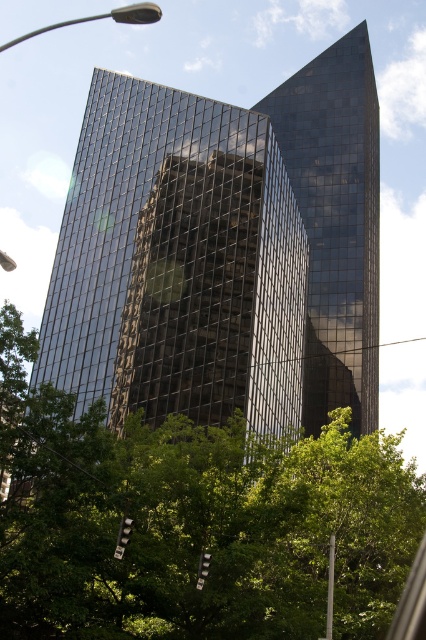
You are a city planner evaluating the impact of new construction on green spaces. You observe the shiny glass building at center and the green leafy tree at lower center in the proposed area. Based on their widths, which structure occupies more horizontal space?

The shiny glass building at center has a greater width than the green leafy tree at lower center, so it occupies more horizontal space.

You are a city planner assessing the impact of new construction on sunlight availability. You observe the shiny glass building at center and the green leafy tree at lower center. Which object would cast a longer shadow during midday in summer?

The shiny glass building at center is much taller than the green leafy tree at lower center, so it would cast a longer shadow during midday in summer.

You are standing at the intersection near the traffic light in the lower left corner and want to take a photo of the shiny glass building at center. Based on your position, will the building be mostly in the background or the foreground of your photo?

The shiny glass building at center is located at point [222,252], which means it is positioned closer to the background rather than the foreground. Therefore, the building will mostly be in the background of your photo.